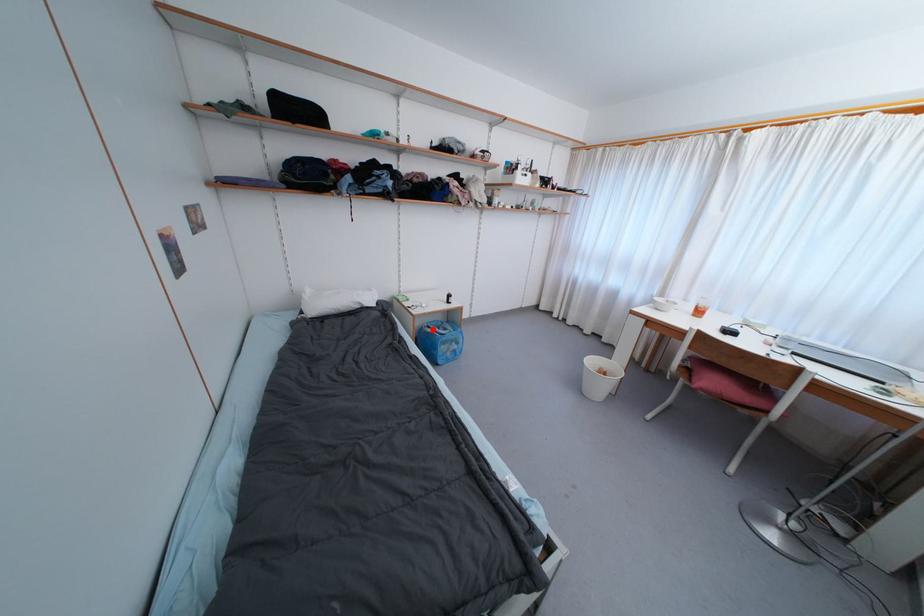
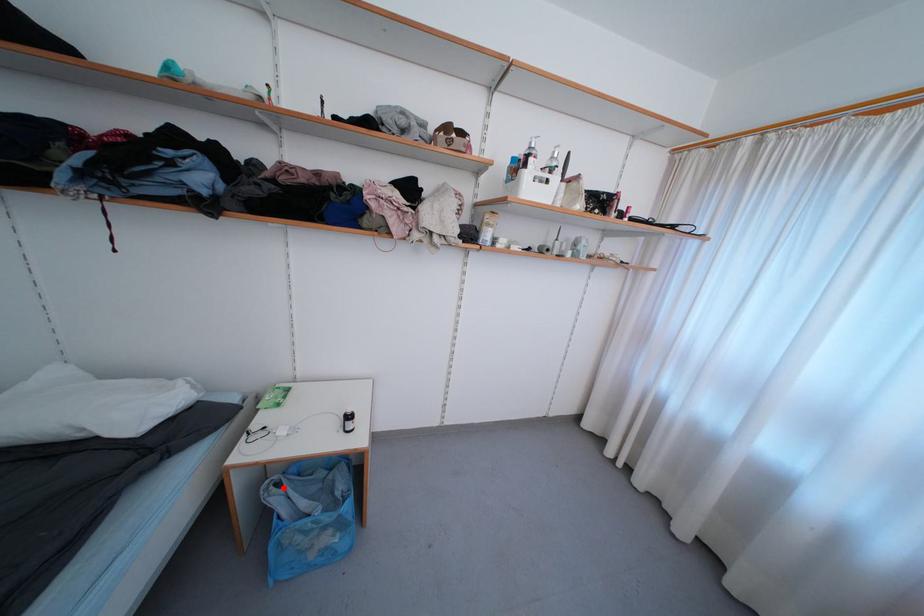
I am providing you with two images of the same scene from different viewpoints. A red point is marked on the first image and another point is marked on the second image. Is the red point in image1 aligned with the point shown in image2?

Yes